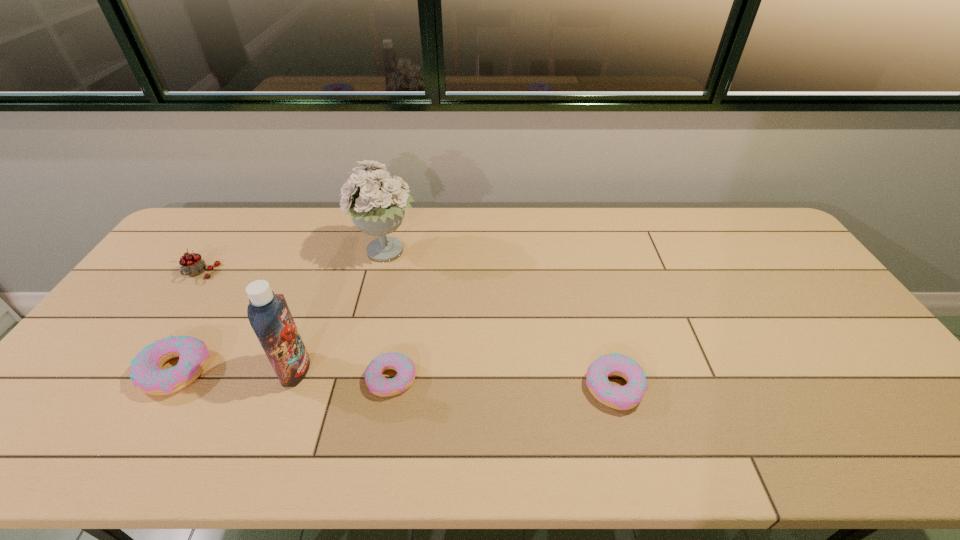
Given the evenly spaced doughnuts in the image, where should an extra doughnut be added on the right to preserve the spacing? Please point to a vacant space. Please provide its 2D coordinates. Your answer should be formatted as a tuple, i.e. [(x, y)], where the tuple contains the x and y coordinates of a point satisfying the conditions above.

[(845, 396)]